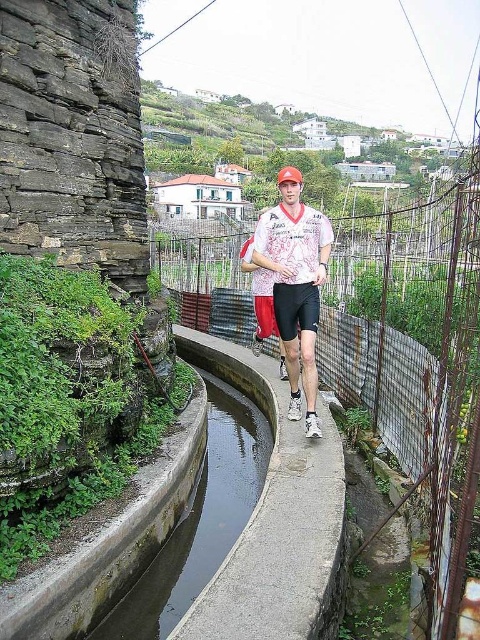
You are a pedestrian standing at the start of the pathway. You see a green concrete canal at center and a white printed shirt at center. Which object is closer to you?

The green concrete canal at center is closer to the viewer than the white printed shirt at center.

You are a delivery drone flying over the pathway and need to land on the green concrete canal at center. What are the coordinates where you should land?

The green concrete canal at center is located at coordinates point (x=201, y=518), so you should land there.